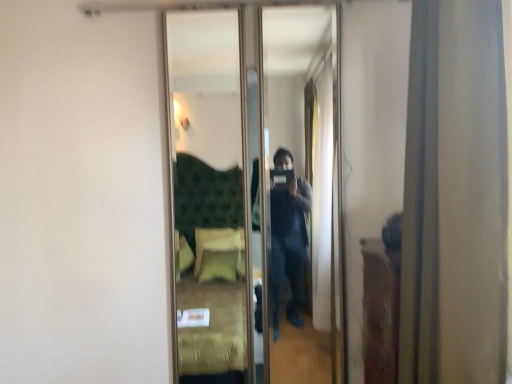
Image resolution: width=512 pixels, height=384 pixels. What do you see at coordinates (215, 192) in the screenshot?
I see `clear glass mirror at center` at bounding box center [215, 192].

Measure the distance between clear glass mirror at center and camera.

The depth of clear glass mirror at center is 6.78 feet.

Looking at this image, what is the approximate width of clear glass mirror at center?

2.23 inches.

Identify the location of clear glass mirror at center. (215, 192).

Measure the distance between matte gold curtain at right and camera.

matte gold curtain at right and camera are 36.49 inches apart.

The width and height of the screenshot is (512, 384). Describe the element at coordinates (455, 197) in the screenshot. I see `matte gold curtain at right` at that location.

Where is `matte gold curtain at right`? The height and width of the screenshot is (384, 512). matte gold curtain at right is located at coordinates (455, 197).

Where is `clear glass mirror at center`? This screenshot has height=384, width=512. clear glass mirror at center is located at coordinates (215, 192).

Between matte gold curtain at right and clear glass mirror at center, which one appears on the right side from the viewer's perspective?

Answer: matte gold curtain at right is more to the right.

Which object is closer to the camera taking this photo, matte gold curtain at right or clear glass mirror at center?

matte gold curtain at right is more forward.

Is point (454, 339) positioned in front of point (249, 110)?

That is True.

From the image's perspective, does matte gold curtain at right appear lower than clear glass mirror at center?

No, from the image's perspective, matte gold curtain at right is not below clear glass mirror at center.

From a real-world perspective, which object stands above the other?

matte gold curtain at right, from a real-world perspective.

Looking at this image, between matte gold curtain at right and clear glass mirror at center, which one has smaller width?

clear glass mirror at center.

Which of these two, matte gold curtain at right or clear glass mirror at center, stands shorter?

matte gold curtain at right is shorter.

In terms of size, does matte gold curtain at right appear bigger or smaller than clear glass mirror at center?

matte gold curtain at right is bigger than clear glass mirror at center.

Choose the correct answer: Is matte gold curtain at right inside clear glass mirror at center or outside it?

matte gold curtain at right lies outside clear glass mirror at center.

Are matte gold curtain at right and clear glass mirror at center located far from each other?

Yes, matte gold curtain at right is far from clear glass mirror at center.

Is matte gold curtain at right facing towards clear glass mirror at center?

No, matte gold curtain at right does not turn towards clear glass mirror at center.

Can you tell me how much matte gold curtain at right and clear glass mirror at center differ in facing direction?

The angle between the facing direction of matte gold curtain at right and the facing direction of clear glass mirror at center is 91.4 degrees.

Where is `curtain lying on the right of clear glass mirror at center`? This screenshot has height=384, width=512. curtain lying on the right of clear glass mirror at center is located at coordinates (455, 197).

Which object is positioned more to the left, clear glass mirror at center or matte gold curtain at right?

clear glass mirror at center.

Based on the photo, relative to matte gold curtain at right, is clear glass mirror at center in front or behind?

Clearly, clear glass mirror at center is behind matte gold curtain at right.

Considering the points (224, 240) and (445, 104), which point is behind, point (224, 240) or point (445, 104)?

The point (224, 240) is farther.

From the image's perspective, between clear glass mirror at center and matte gold curtain at right, which one is located above?

matte gold curtain at right, from the image's perspective.

From a real-world perspective, between clear glass mirror at center and matte gold curtain at right, who is vertically higher?

matte gold curtain at right is physically above.

Which of these two, clear glass mirror at center or matte gold curtain at right, is thinner?

clear glass mirror at center is thinner.

Can you confirm if clear glass mirror at center is shorter than matte gold curtain at right?

Incorrect, the height of clear glass mirror at center does not fall short of that of matte gold curtain at right.

Considering the sizes of clear glass mirror at center and matte gold curtain at right in the image, is clear glass mirror at center bigger or smaller than matte gold curtain at right?

In the image, clear glass mirror at center appears to be smaller than matte gold curtain at right.

Does clear glass mirror at center contain matte gold curtain at right?

No, matte gold curtain at right is not surrounded by clear glass mirror at center.

Does clear glass mirror at center touch matte gold curtain at right?

clear glass mirror at center is not next to matte gold curtain at right, and they're not touching.

Does clear glass mirror at center turn towards matte gold curtain at right?

Yes, clear glass mirror at center is turned towards matte gold curtain at right.

How different are the orientations of clear glass mirror at center and matte gold curtain at right in degrees?

91.4 degrees separate the facing orientations of clear glass mirror at center and matte gold curtain at right.

Find the location of a particular element. The height and width of the screenshot is (384, 512). mirror on the left of matte gold curtain at right is located at coordinates (x=215, y=192).

Find the location of a particular element. The width and height of the screenshot is (512, 384). mirror lying below the matte gold curtain at right (from the image's perspective) is located at coordinates (215, 192).

What are the coordinates of `curtain that appears on the right of clear glass mirror at center` in the screenshot? It's located at (455, 197).